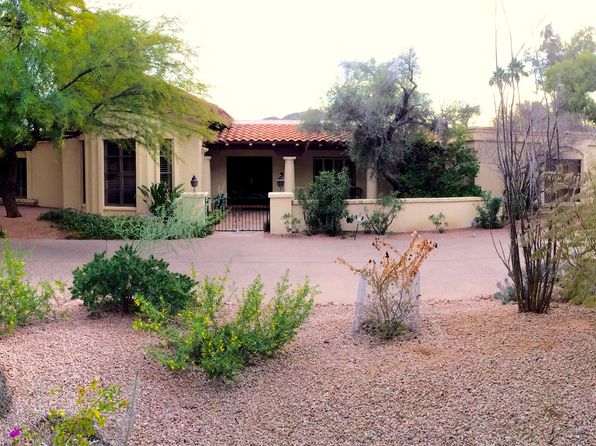
At what (x,y) coordinates should I click in order to perform the action: click on small metal sign toward the center right in the background. Please return your answer as a coordinate pair (x, y). Image resolution: width=596 pixels, height=446 pixels. Looking at the image, I should click on (359, 222).